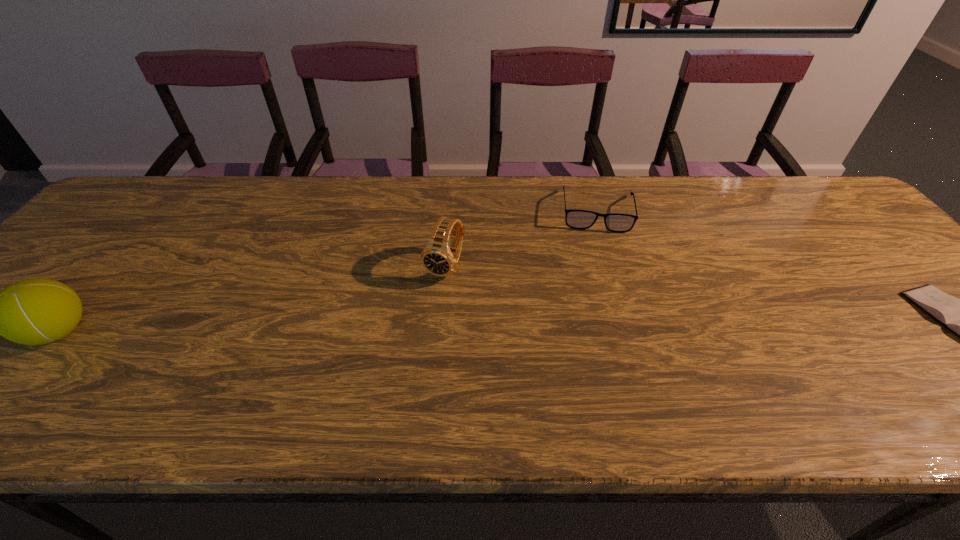
Image resolution: width=960 pixels, height=540 pixels. Find the location of `the leftmost object`. the leftmost object is located at coordinates (36, 311).

Locate an element on the screen. The width and height of the screenshot is (960, 540). the third object from left to right is located at coordinates (577, 219).

Locate an element on the screen. The image size is (960, 540). the third tallest object is located at coordinates pyautogui.click(x=577, y=219).

I want to click on the second object from left to right, so click(x=439, y=258).

Identify the location of free space located on the back of the tennis ball. The image size is (960, 540). (93, 292).

Locate an element on the screen. Image resolution: width=960 pixels, height=540 pixels. blank area located 0.120m on the front-facing side of the third tallest object is located at coordinates (602, 264).

This screenshot has width=960, height=540. In order to click on blank space located on the front-facing side of the third tallest object in this screenshot , I will do `click(606, 315)`.

I want to click on vacant space located 0.060m on the front-facing side of the third tallest object, so click(x=601, y=248).

Find the location of a particular element. free spot located on the face of the watch is located at coordinates (428, 305).

You are a GUI agent. You are given a task and a screenshot of the screen. Output one action in this format:
    pyautogui.click(x=<x>, y=<y>)
    Task: Click on the vacant space located on the face of the watch
    This screenshot has height=540, width=960.
    Given the screenshot: What is the action you would take?
    pyautogui.click(x=399, y=361)